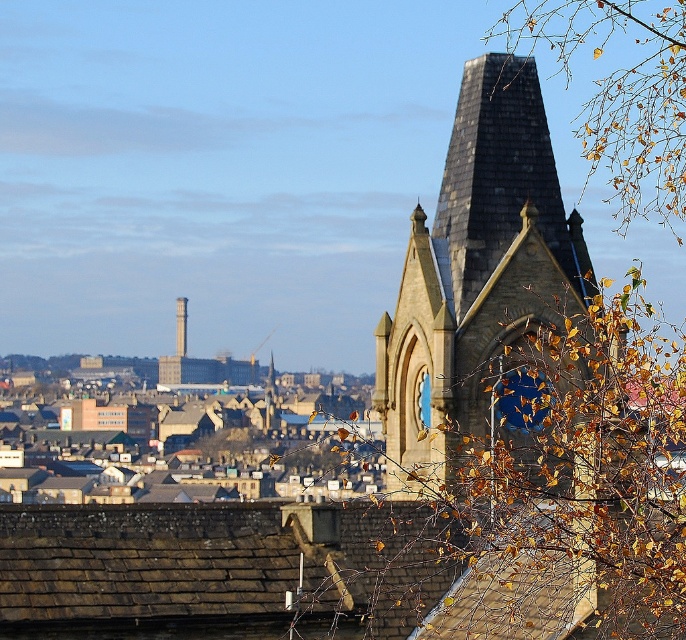
Question: Which of the following is the farthest from the observer?

Choices:
 (A) brown stone tower at center
 (B) light gray stone bell tower at center
 (C) golden leaves at upper right
 (D) blue glass clock at upper center

Answer: (B)

Question: Is golden leaves at upper right thinner than blue glass clock at upper center?

Choices:
 (A) no
 (B) yes

Answer: (A)

Question: Is brown stone tower at center above blue glass clock at upper center?

Choices:
 (A) yes
 (B) no

Answer: (A)

Question: Which of these objects is positioned farthest from the light gray stone bell tower at center?

Choices:
 (A) golden leafy branch at upper right
 (B) blue glass clock at upper center
 (C) brown stone tower at center

Answer: (B)

Question: Which is farther from the blue glass clock at upper center?

Choices:
 (A) golden leaves at upper right
 (B) light gray stone bell tower at center
 (C) brown stone tower at center
 (D) golden leafy branch at upper right

Answer: (B)

Question: In this image, where is golden leaves at upper right located relative to light gray stone bell tower at center?

Choices:
 (A) left
 (B) right

Answer: (B)